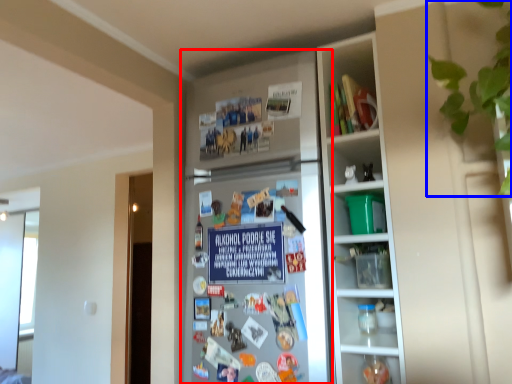
Question: Which of the following is the closest to the observer, fridge (highlighted by a red box) or plant (highlighted by a blue box)?

Choices:
 (A) fridge
 (B) plant

Answer: (B)